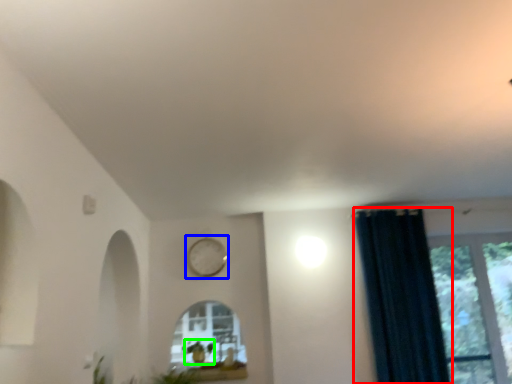
Question: Which is farther away from curtain (highlighted by a red box)? clock (highlighted by a blue box) or plant (highlighted by a green box)?

Choices:
 (A) clock
 (B) plant

Answer: (B)